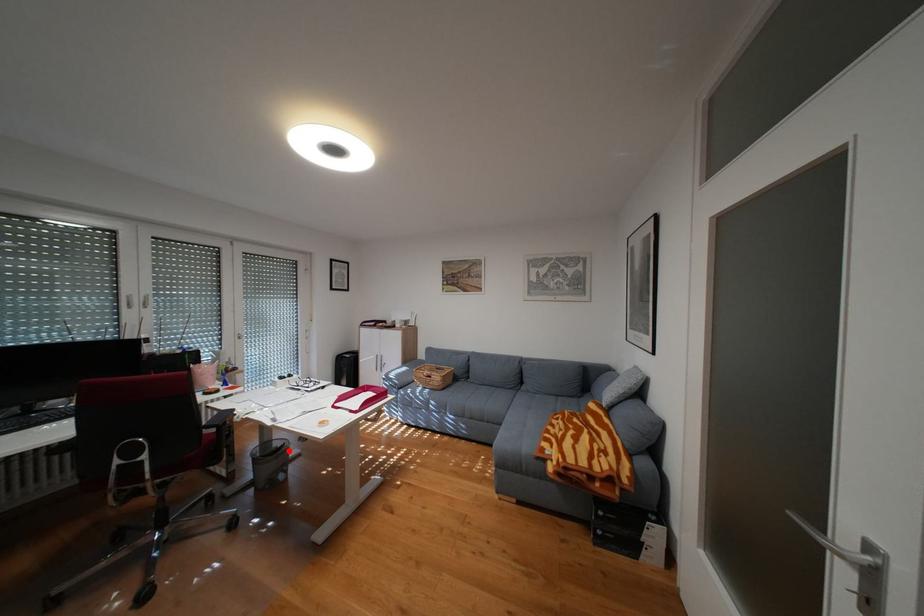
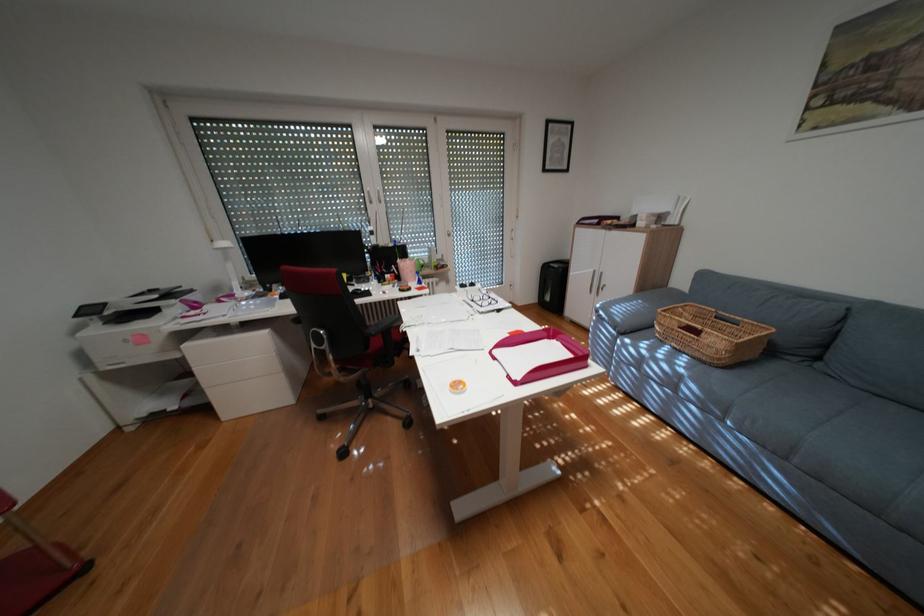
Question: I am providing you with two images of the same scene from different viewpoints. A red point is marked on the first image. At the location where the point appears in image 1, is it still visible in image 2?

Choices:
 (A) Yes
 (B) No

Answer: (B)